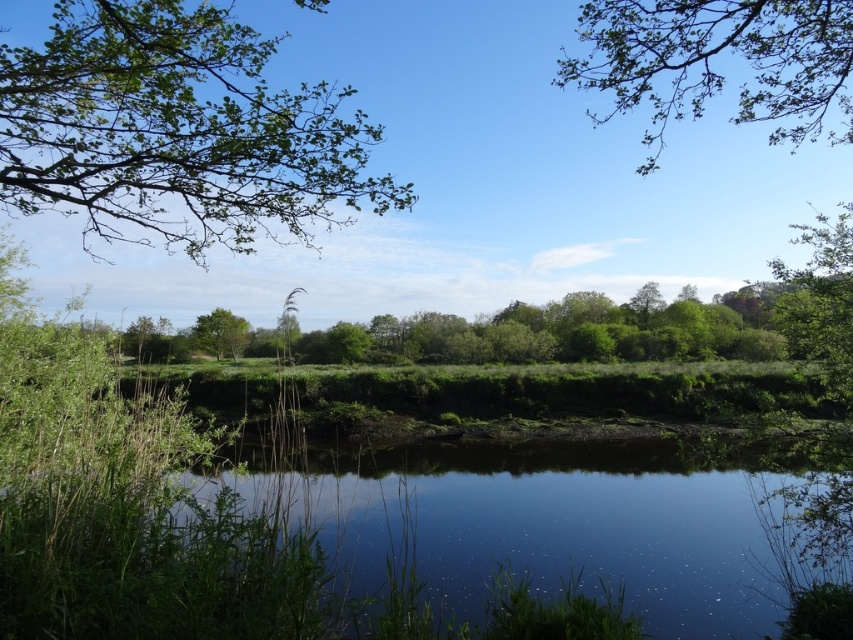
You are an artist sketching the landscape and want to capture the size relationship between the green leafy branches at upper left and the green leafy tree at center. Which one should you draw larger in your sketch?

The green leafy branches at upper left should be drawn larger than the green leafy tree at center because the description states that the green leafy branches at upper left is larger in size than the green leafy tree at center.

You are an artist sketching the landscape and want to capture the relative sizes of the green leafy branches at upper right and the green leafy tree at center. Which one should you draw wider in your sketch?

You should draw the green leafy branches at upper right wider because its width is larger than the green leafy tree at center.